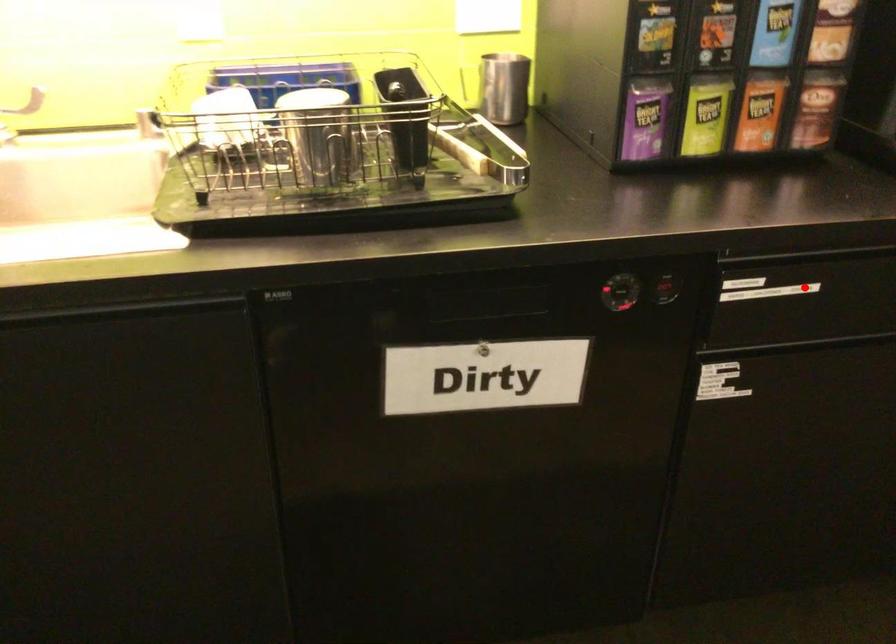
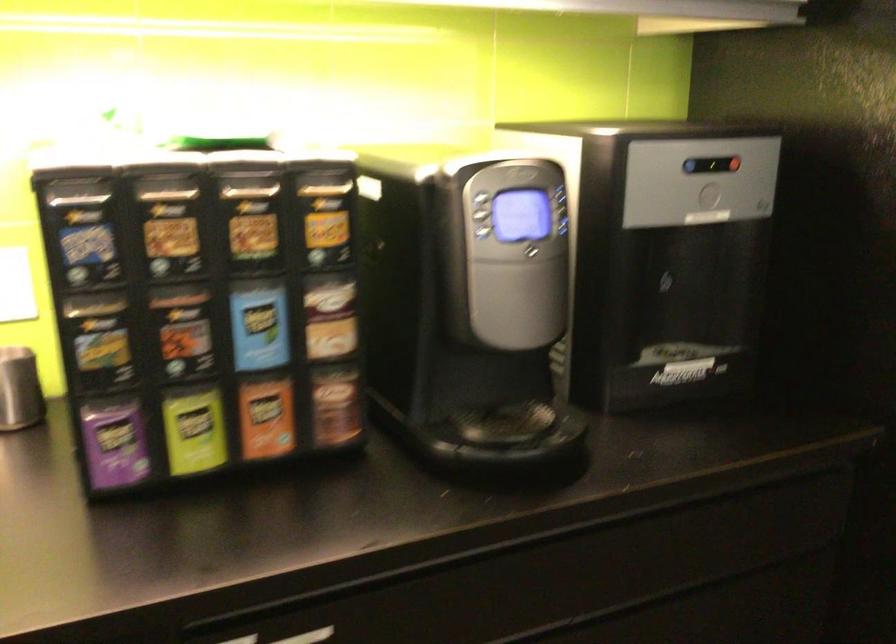
Question: I am providing you with two images of the same scene from different viewpoints. In image1, a red point is highlighted. Considering the same 3D point in image2, which of the following is correct?

Choices:
 (A) It is closer
 (B) It is farther

Answer: (A)